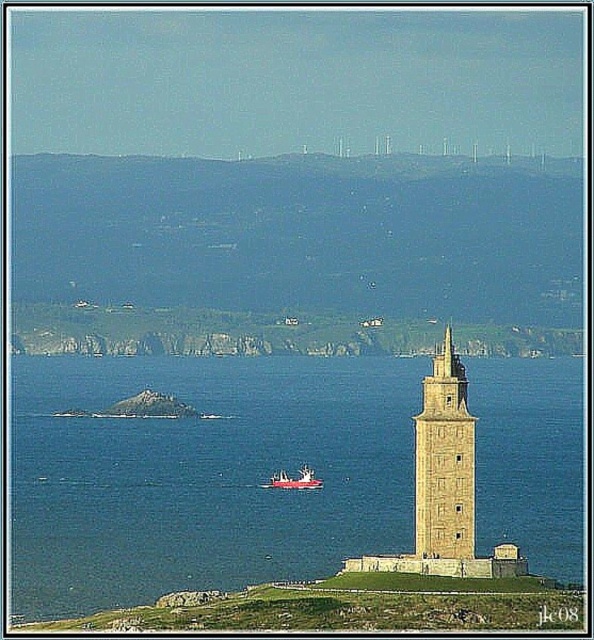
You are standing on the grassy mound near the beige stone tower at center and want to look at the red plastic boat at center. In which direction should you turn your head to see it?

You should turn your head to the left to see the red plastic boat at center because the beige stone tower at center is to the right of the red plastic boat at center.

You are a photographer planning to capture the stone tower and the red plastic boat at center from the grassy mound. Given that the boat is 2 meters long, can you estimate whether the blue water at center is wide enough to fit three boats of the same size side by side?

The blue water at center might be wider than red plastic boat at center, but without exact measurements, it is uncertain if three boats can fit. The boat is 2 meters long, so three would require 6 meters. However, the description only states the water is wider than the boat, not by how much.